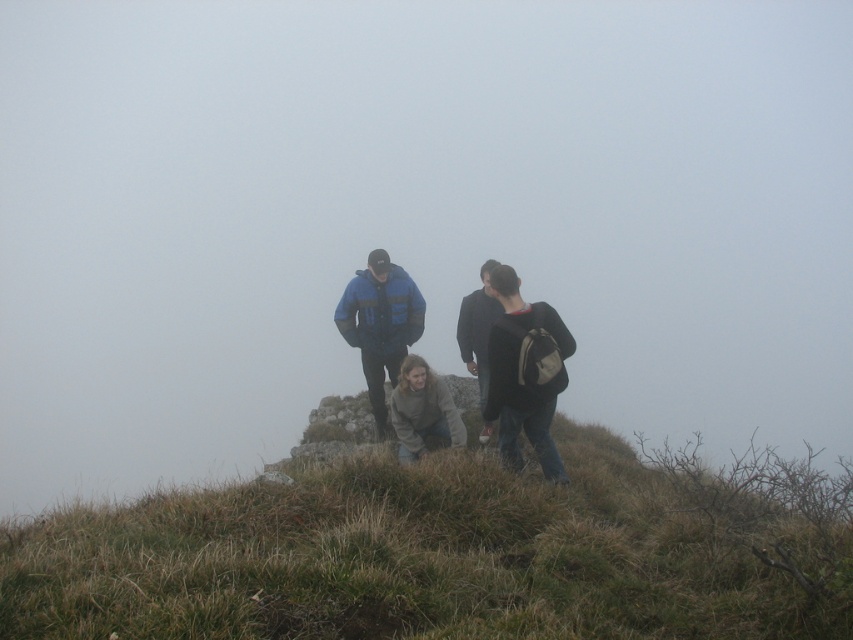
You are a photographer trying to capture a landscape photo that includes both the green grassy hillside at center and the dark gray sweater at center. Since the camera can only focus on one object at a time, which object should you choose to ensure the larger object is in focus?

The green grassy hillside at center is larger in size than the dark gray sweater at center, so you should focus on the green grassy hillside at center to ensure the larger object is in focus.

You are a photographer trying to capture a group photo of the dark gray sweater at center and the green grassy hillside at center. Your camera has a maximum focus range of 3 meters. Can you capture both subjects in focus without moving either?

The distance between the dark gray sweater at center and the green grassy hillside at center is 3.05 meters. Since the camera can only focus up to 3 meters, it cannot capture both subjects in focus without moving them.